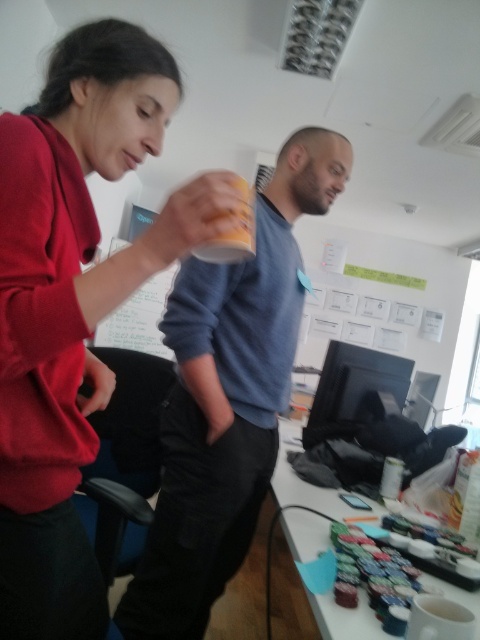
Which is below, blue cotton sweater at center or matte plastic cup at center?

blue cotton sweater at center

Can you confirm if blue cotton sweater at center is bigger than matte plastic cup at center?

Indeed, blue cotton sweater at center has a larger size compared to matte plastic cup at center.

This screenshot has width=480, height=640. Find the location of `blue cotton sweater at center`. blue cotton sweater at center is located at coordinates (228, 397).

Identify the location of blue cotton sweater at center. This screenshot has width=480, height=640. (228, 397).

Is point (205, 538) closer to viewer compared to point (275, 481)?

Yes, it is in front of point (275, 481).

Is blue cotton sweater at center above white glossy table at lower right?

Yes.

Is point (169, 570) more distant than point (285, 528)?

That is True.

The height and width of the screenshot is (640, 480). Find the location of `blue cotton sweater at center`. blue cotton sweater at center is located at coordinates (228, 397).

What do you see at coordinates (312, 484) in the screenshot? I see `white glossy table at lower right` at bounding box center [312, 484].

Who is positioned more to the right, white glossy table at lower right or matte plastic cup at center?

Positioned to the right is white glossy table at lower right.

Image resolution: width=480 pixels, height=640 pixels. Describe the element at coordinates (312, 484) in the screenshot. I see `white glossy table at lower right` at that location.

Find the location of `white glossy table at lower right`. white glossy table at lower right is located at coordinates (312, 484).